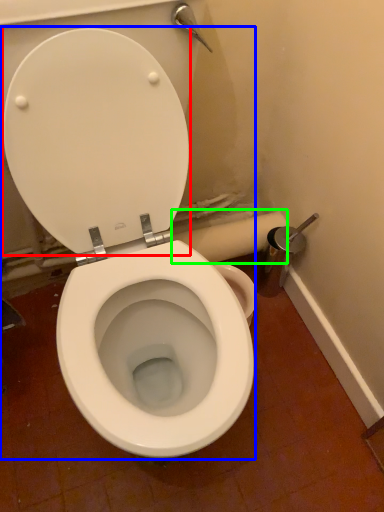
Question: Which object is positioned farthest from back (highlighted by a red box)? Select from toilet (highlighted by a blue box) and toilet paper (highlighted by a green box).

Choices:
 (A) toilet
 (B) toilet paper

Answer: (B)